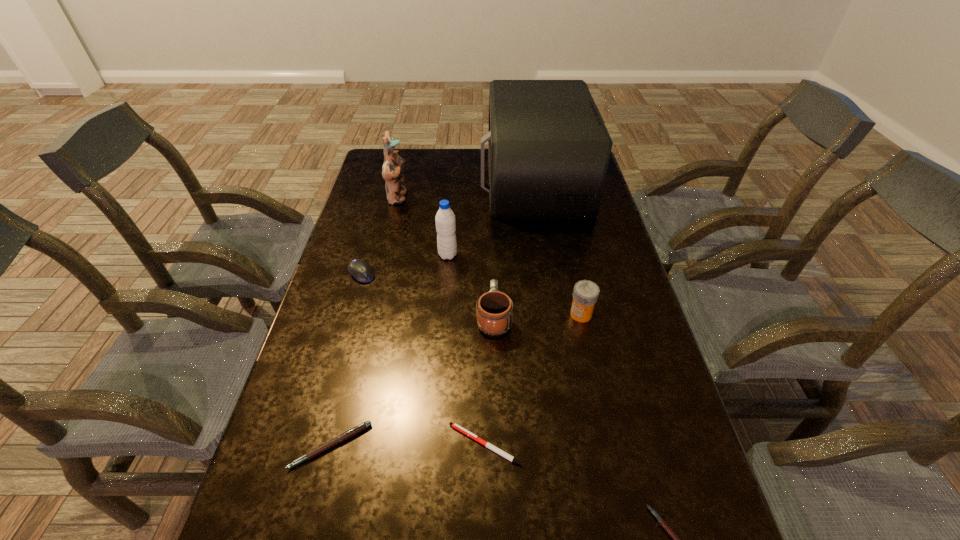
This screenshot has width=960, height=540. I want to click on free space located on the side of the mug with the handle, so click(492, 247).

The image size is (960, 540). Find the location of `free space located on the side of the mug with the handle`. free space located on the side of the mug with the handle is located at coordinates pos(492,278).

You are a GUI agent. You are given a task and a screenshot of the screen. Output one action in this format:
    pyautogui.click(x=<x>, y=<y>)
    Task: Click on the vacant space located on the side of the mug with the handle
    The height and width of the screenshot is (540, 960).
    Given the screenshot: What is the action you would take?
    pyautogui.click(x=492, y=235)

Image resolution: width=960 pixels, height=540 pixels. What are the coordinates of `vacant space situated on the front of the sixth tallest object` in the screenshot? It's located at (332, 380).

You are a GUI agent. You are given a task and a screenshot of the screen. Output one action in this format:
    pyautogui.click(x=<x>, y=<y>)
    Task: Click on the free space located 0.100m at the nib of the bigger pink pen
    The image size is (960, 540).
    Given the screenshot: What is the action you would take?
    pyautogui.click(x=311, y=525)

Where is `vacant region located 0.160m on the clicker of the white pen`? vacant region located 0.160m on the clicker of the white pen is located at coordinates (372, 444).

This screenshot has height=540, width=960. In order to click on free location located 0.130m on the clicker of the white pen in this screenshot , I will do `click(386, 444)`.

Locate an element on the screen. vacant space located on the clicker of the white pen is located at coordinates (420, 444).

Image resolution: width=960 pixels, height=540 pixels. I want to click on object that is positioned at the far edge, so click(549, 149).

Identify the location of figurine present at the left edge. (392, 171).